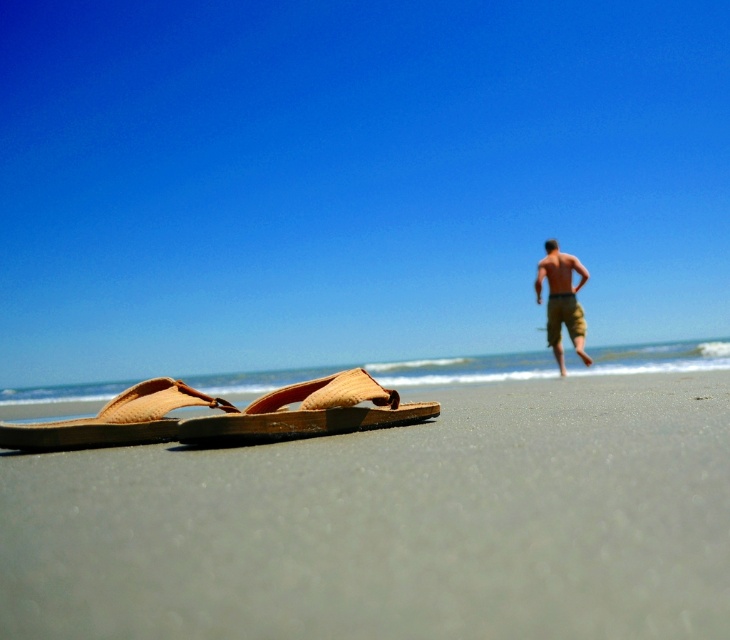
Question: Is tan leather flip-flops at lower left further to camera compared to tan cotton shorts at right?

Choices:
 (A) yes
 (B) no

Answer: (B)

Question: Which point is farther to the camera?

Choices:
 (A) tan cotton shorts at right
 (B) tan leather flip-flops at lower left

Answer: (A)

Question: Is tan leather sandal at lower center positioned behind tan leather sandal at lower left?

Choices:
 (A) no
 (B) yes

Answer: (A)

Question: Which object appears farthest from the camera in this image?

Choices:
 (A) tan cotton shorts at right
 (B) tan leather sandal at lower left

Answer: (A)

Question: Which of these objects is positioned farthest from the tan leather sandal at lower left?

Choices:
 (A) tan leather sandal at lower center
 (B) tan cotton shorts at right

Answer: (B)

Question: Is tan leather sandal at lower left smaller than tan cotton shorts at right?

Choices:
 (A) yes
 (B) no

Answer: (A)